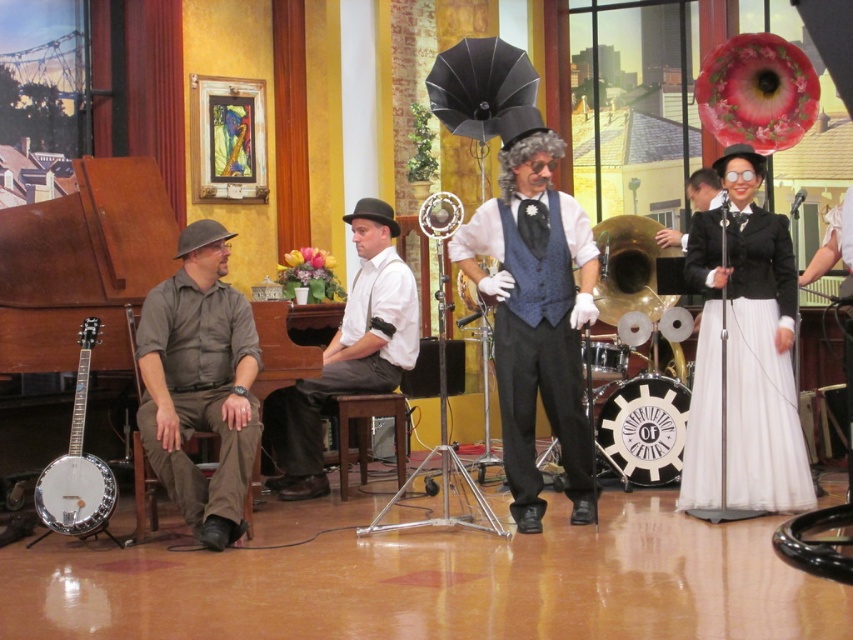
Between white sheer dress at right and white cotton shirt at center, which one has more height?

With more height is white cotton shirt at center.

Does point (686, 465) come behind point (412, 320)?

That is False.

Is point (801, 497) farther from camera compared to point (395, 304)?

No, it is in front of (395, 304).

This screenshot has height=640, width=853. In order to click on white sheer dress at right in this screenshot , I will do `click(761, 416)`.

Between point (584, 484) and point (390, 358), which one is positioned in front?

Positioned in front is point (584, 484).

Can you confirm if blue textured vest at center is wider than white cotton shirt at center?

No.

Is point (577, 515) positioned after point (372, 243)?

No, (577, 515) is closer to viewer.

Where is `blue textured vest at center`? The width and height of the screenshot is (853, 640). blue textured vest at center is located at coordinates (535, 310).

Does gold brass tuba at center have a greater height compared to wooden stool at center?

Indeed, gold brass tuba at center has a greater height compared to wooden stool at center.

Is gold brass tuba at center above wooden stool at center?

Correct, gold brass tuba at center is located above wooden stool at center.

Which is behind, point (628, 218) or point (389, 408)?

Point (628, 218)

This screenshot has width=853, height=640. I want to click on gold brass tuba at center, so click(x=630, y=268).